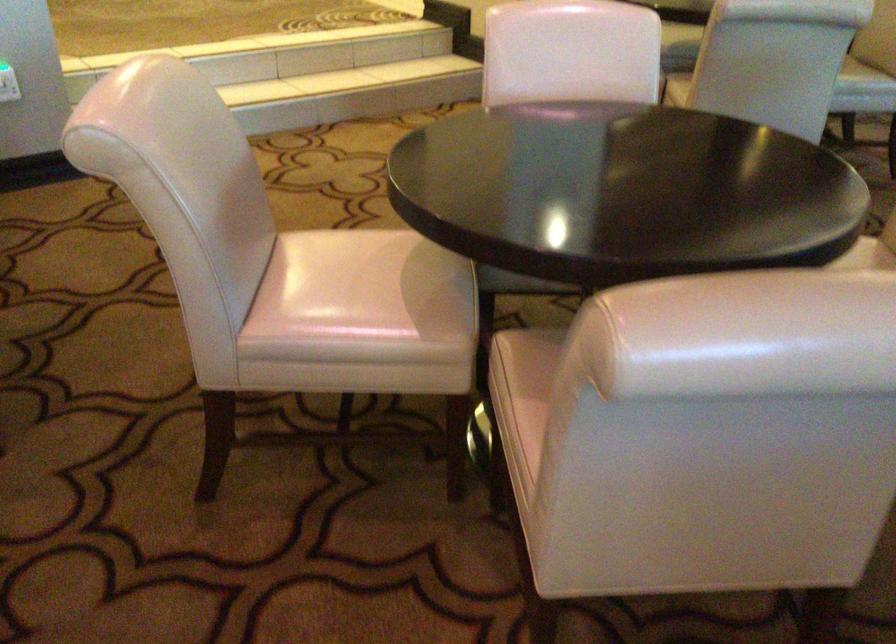
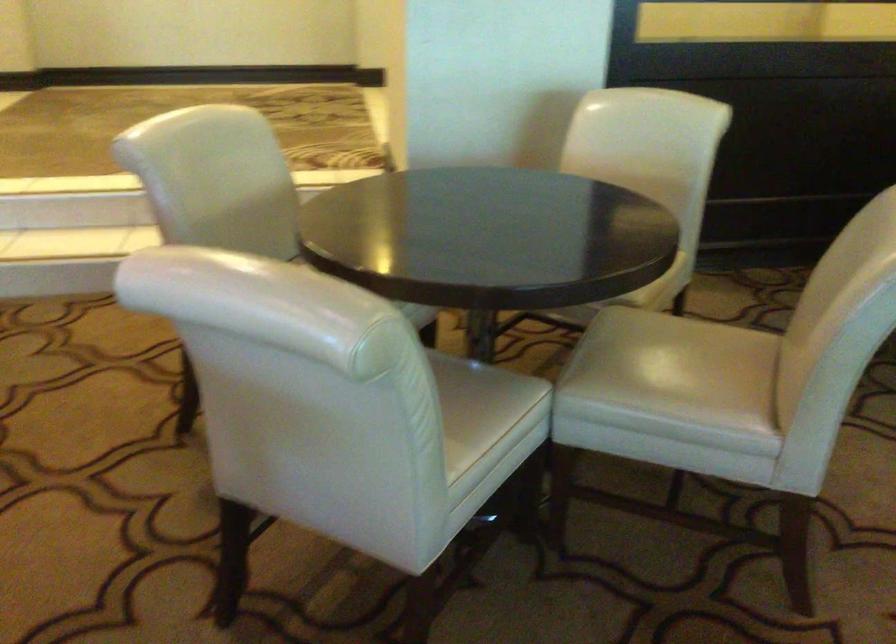
In a continuous first-person perspective shot, in which direction is the camera moving?

The movement direction of the cameraman is right, forward.